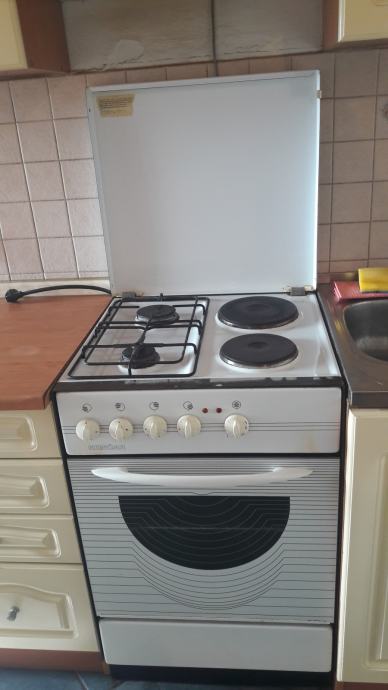
Find the location of a particular element. front gas cooktop burner is located at coordinates (135, 355).